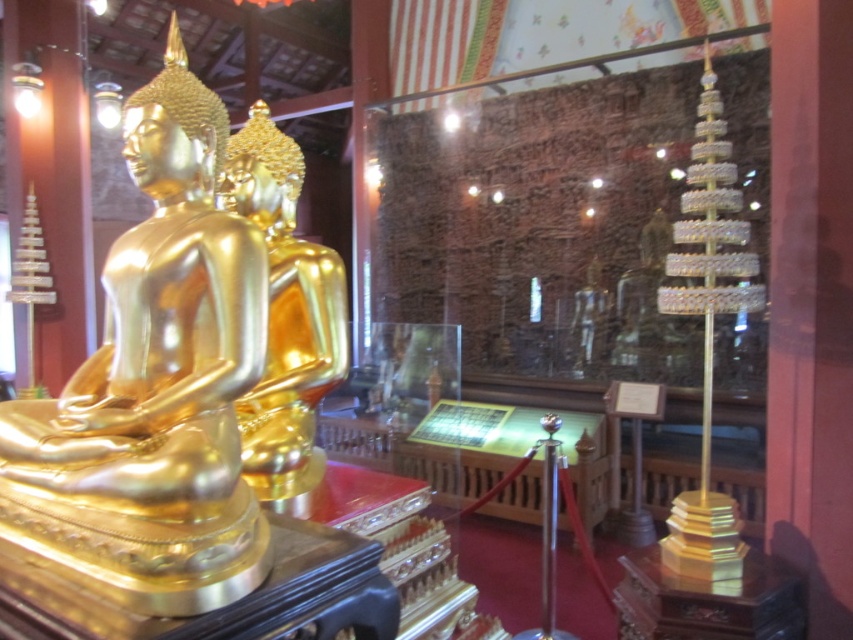
You are a visitor in the museum and want to take a photo of both the gold shiny statue at left and the gold shiny statue at center. Which statue should you position closer to the left side of your camera frame to capture both in the shot?

You should position the gold shiny statue at left closer to the left side of your camera frame since it is already to the left of the gold shiny statue at center, ensuring both are included in the photo.

You are a museum visitor holding a 12 inch wide box. You want to place this box between the gold shiny statue at left and the gold shiny statue at center. Is there enough space?

The distance between the gold shiny statue at left and the gold shiny statue at center is 13.38 inches, so yes, the 12 inch wide box can fit between them since the space is wider than the box.

Consider the image. You are a visitor in the museum and want to take a photo of both the gold shiny statue at left and the gold shiny statue at center. Which statue should you move closer to in order to capture both in the same frame?

You should move closer to the gold shiny statue at left because it is smaller than the gold shiny statue at center, allowing both to fit within the camera frame more easily when positioned nearer to the smaller one.